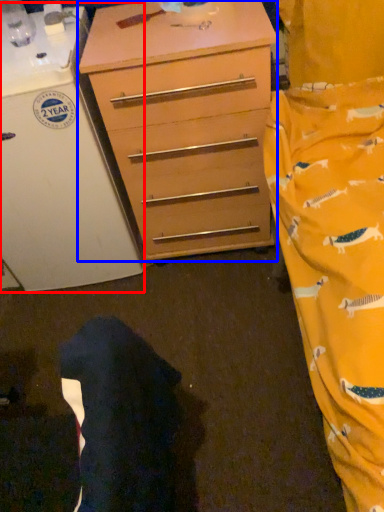
Question: Which point is closer to the camera, appliance (highlighted by a red box) or chest of drawers (highlighted by a blue box)?

Choices:
 (A) appliance
 (B) chest of drawers

Answer: (A)